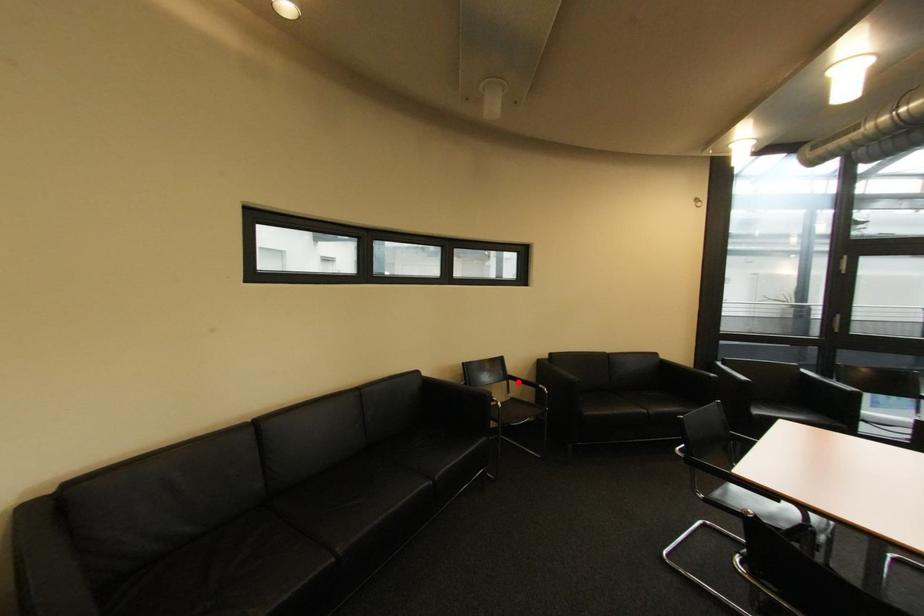
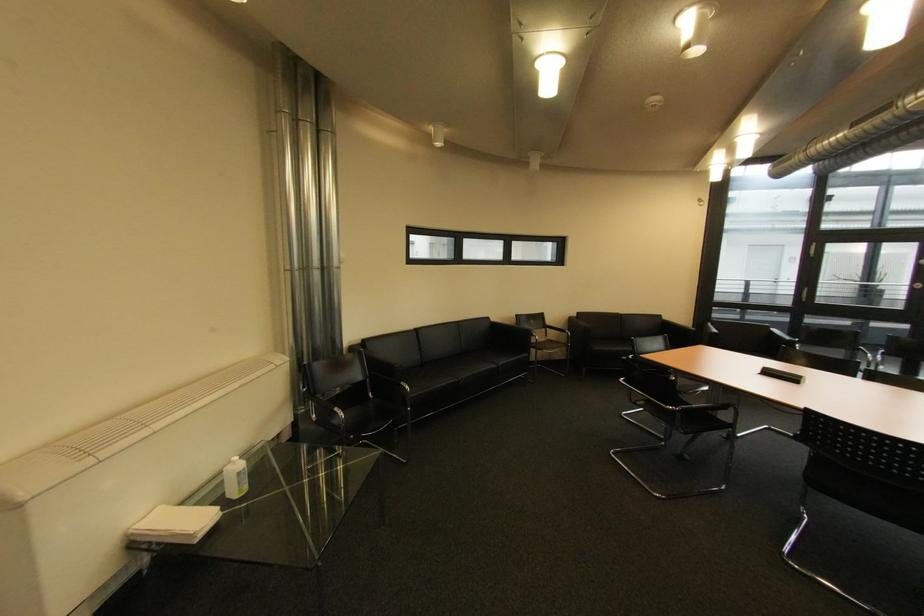
Find the pixel in the second image that matches the highlighted location in the first image.

(555, 330)